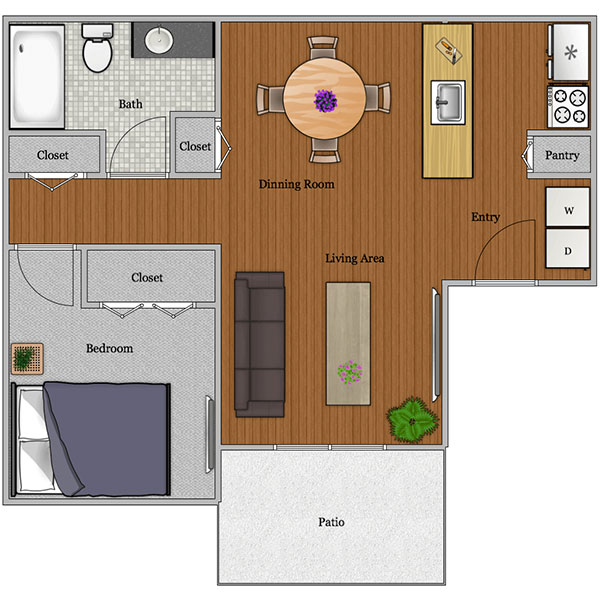
Identify the location of storage areas. Image resolution: width=600 pixels, height=600 pixels. (141, 275), (54, 156), (194, 147), (556, 152).